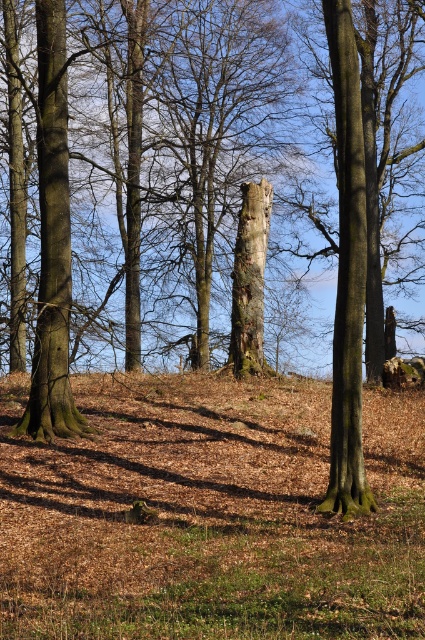
Who is more forward, [348,172] or [45,401]?

Point [348,172]

Can you confirm if smooth brown tree trunk at right is bigger than smooth brown tree trunk at left?

Correct, smooth brown tree trunk at right is larger in size than smooth brown tree trunk at left.

The width and height of the screenshot is (425, 640). What do you see at coordinates (348, 273) in the screenshot?
I see `smooth brown tree trunk at right` at bounding box center [348, 273].

The height and width of the screenshot is (640, 425). What are the coordinates of `smooth brown tree trunk at right` in the screenshot? It's located at click(348, 273).

Is smooth brown tree trunk at left above smooth brown tree trunk at center?

Correct, smooth brown tree trunk at left is located above smooth brown tree trunk at center.

Is smooth brown tree trunk at left shorter than smooth brown tree trunk at center?

No.

Does point (33, 416) lie in front of point (235, 248)?

That is True.

The height and width of the screenshot is (640, 425). I want to click on smooth brown tree trunk at left, so click(51, 241).

From the picture: Between smooth brown tree trunk at right and smooth brown tree trunk at center, which one appears on the right side from the viewer's perspective?

smooth brown tree trunk at right is more to the right.

Describe the element at coordinates (348, 273) in the screenshot. The width and height of the screenshot is (425, 640). I see `smooth brown tree trunk at right` at that location.

This screenshot has width=425, height=640. What are the coordinates of `smooth brown tree trunk at right` in the screenshot? It's located at (348, 273).